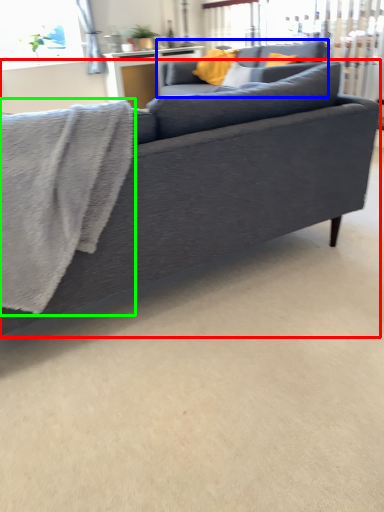
Question: Based on their relative distances, which object is nearer to studio couch (highlighted by a red box)? Choose from studio couch (highlighted by a blue box) and bath towel (highlighted by a green box).

Choices:
 (A) studio couch
 (B) bath towel

Answer: (B)